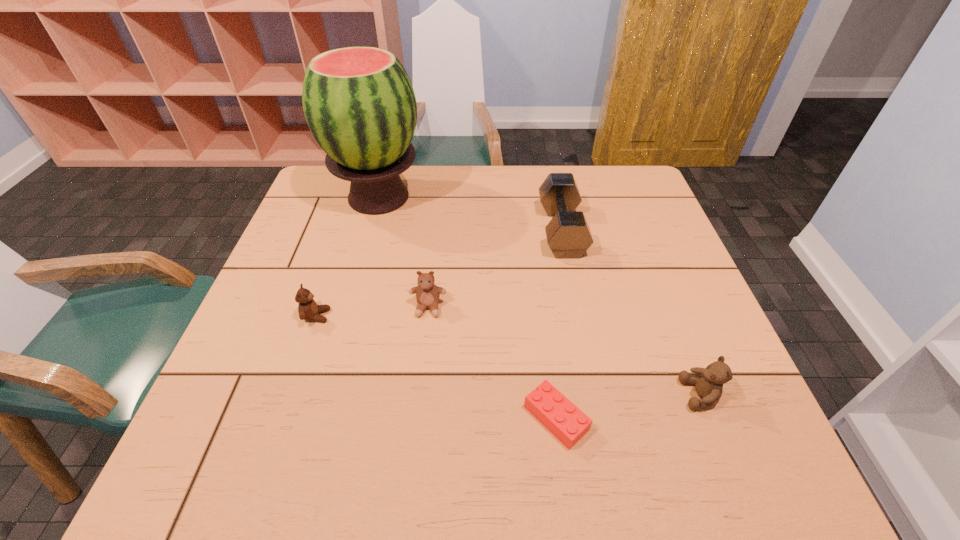
Locate an element on the screen. the second closest teddy bear to the second teddy bear from right to left is located at coordinates click(709, 385).

Find the location of `teddy bear that is the second closest to the watermelon`. teddy bear that is the second closest to the watermelon is located at coordinates (308, 309).

Locate an element on the screen. The width and height of the screenshot is (960, 540). free location that satisfies the following two spatial constraints: 1. at the face of the shortest object; 2. on the left side of the leftmost teddy bear is located at coordinates (281, 418).

This screenshot has width=960, height=540. Find the location of `vacant position in the image that satisfies the following two spatial constraints: 1. on the front side of the dumbbell; 2. at the face of the leftmost teddy bear`. vacant position in the image that satisfies the following two spatial constraints: 1. on the front side of the dumbbell; 2. at the face of the leftmost teddy bear is located at coordinates (580, 316).

I want to click on free region that satisfies the following two spatial constraints: 1. on the front-facing side of the Lego; 2. on the right side of the third object from left to right, so click(x=416, y=418).

Where is `vacant space that satisfies the following two spatial constraints: 1. at the face of the leftmost teddy bear; 2. on the right side of the shortest object`? The height and width of the screenshot is (540, 960). vacant space that satisfies the following two spatial constraints: 1. at the face of the leftmost teddy bear; 2. on the right side of the shortest object is located at coordinates (281, 418).